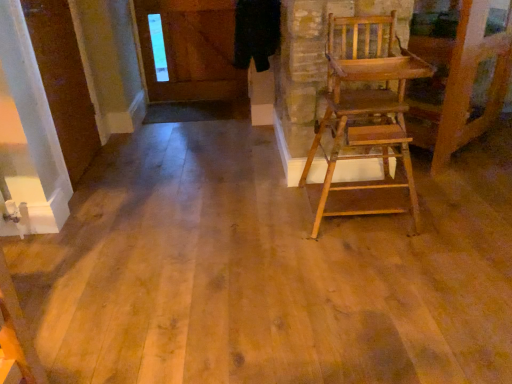
Where is `blank area beneath wooden high chair at right (from a real-world perspective)`? blank area beneath wooden high chair at right (from a real-world perspective) is located at coordinates (361, 216).